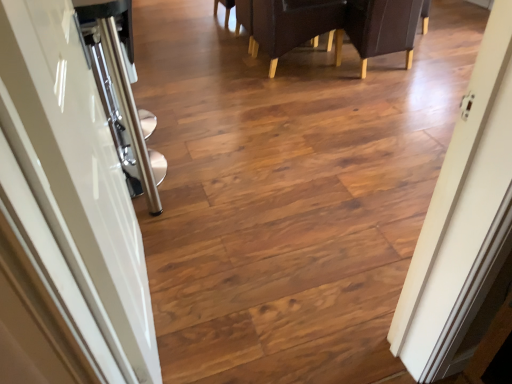
Identify the location of leather-like dark brown chair at upper center. (331, 25).

Identify the location of dark brown leather armchair at upper right, the second armchair from the left. This screenshot has height=384, width=512. (380, 28).

Find the location of a particular element. Image resolution: width=512 pixels, height=384 pixels. glossy white door at left is located at coordinates (67, 208).

Is leather-like dark brown chair at upper center wider than dark brown leather armchair at upper right, the second armchair from the left?

Yes.

Which object is further away from the camera, leather-like dark brown chair at upper center or dark brown leather armchair at upper right, positioned as the first armchair in right-to-left order?

leather-like dark brown chair at upper center is behind.

Which point is more distant from viewer, [257,1] or [412,18]?

The point [257,1] is more distant.

Is leather-like dark brown chair at upper center far away from dark brown leather armchair at upper right, the second armchair from the left?

That's not correct — leather-like dark brown chair at upper center is a little close to dark brown leather armchair at upper right, the second armchair from the left.

Is dark brown leather armchair at upper center, arranged as the 2th armchair when viewed from the right, far from glossy white door at left?

Indeed, dark brown leather armchair at upper center, arranged as the 2th armchair when viewed from the right, is not near glossy white door at left.

Is dark brown leather armchair at upper center, acting as the first armchair starting from the left, surrounding glossy white door at left?

Actually, glossy white door at left is outside dark brown leather armchair at upper center, acting as the first armchair starting from the left.

In terms of size, does dark brown leather armchair at upper center, arranged as the 2th armchair when viewed from the right, appear bigger or smaller than glossy white door at left?

Clearly, dark brown leather armchair at upper center, arranged as the 2th armchair when viewed from the right, is larger in size than glossy white door at left.

Considering the sizes of dark brown leather armchair at upper center, acting as the first armchair starting from the left, and glossy white door at left in the image, is dark brown leather armchair at upper center, acting as the first armchair starting from the left, taller or shorter than glossy white door at left?

dark brown leather armchair at upper center, acting as the first armchair starting from the left, is shorter than glossy white door at left.

Could dark brown leather armchair at upper center, acting as the first armchair starting from the left, be considered to be inside leather-like dark brown chair at upper center?

Yes, leather-like dark brown chair at upper center contains dark brown leather armchair at upper center, acting as the first armchair starting from the left.

Is leather-like dark brown chair at upper center not near dark brown leather armchair at upper center, arranged as the 2th armchair when viewed from the right?

No, there isn't a large distance between leather-like dark brown chair at upper center and dark brown leather armchair at upper center, arranged as the 2th armchair when viewed from the right.

Between leather-like dark brown chair at upper center and dark brown leather armchair at upper center, arranged as the 2th armchair when viewed from the right, which one has smaller width?

With smaller width is dark brown leather armchair at upper center, arranged as the 2th armchair when viewed from the right.

How much distance is there between leather-like dark brown chair at upper center and dark brown leather armchair at upper center, arranged as the 2th armchair when viewed from the right?

leather-like dark brown chair at upper center is 3.20 inches away from dark brown leather armchair at upper center, arranged as the 2th armchair when viewed from the right.

Who is more distant, dark brown leather armchair at upper center, acting as the first armchair starting from the left, or dark brown leather armchair at upper right, the second armchair from the left?

dark brown leather armchair at upper center, acting as the first armchair starting from the left, is further away from the camera.

How different are the orientations of dark brown leather armchair at upper center, acting as the first armchair starting from the left, and dark brown leather armchair at upper right, the second armchair from the left, in degrees?

The facing directions of dark brown leather armchair at upper center, acting as the first armchair starting from the left, and dark brown leather armchair at upper right, the second armchair from the left, are 89.5 degrees apart.

Is dark brown leather armchair at upper center, acting as the first armchair starting from the left, taller or shorter than dark brown leather armchair at upper right, the second armchair from the left?

dark brown leather armchair at upper center, acting as the first armchair starting from the left, is shorter than dark brown leather armchair at upper right, the second armchair from the left.

Is dark brown leather armchair at upper center, acting as the first armchair starting from the left, facing away from dark brown leather armchair at upper right, positioned as the first armchair in right-to-left order?

No, dark brown leather armchair at upper center, acting as the first armchair starting from the left, is not facing the opposite direction of dark brown leather armchair at upper right, positioned as the first armchair in right-to-left order.

The image size is (512, 384). Find the location of `door in front of the leather-like dark brown chair at upper center`. door in front of the leather-like dark brown chair at upper center is located at coordinates (67, 208).

Which is correct: leather-like dark brown chair at upper center is inside glossy white door at left, or outside of it?

leather-like dark brown chair at upper center lies outside glossy white door at left.

Consider the image. Is leather-like dark brown chair at upper center with glossy white door at left?

No, leather-like dark brown chair at upper center is not next to glossy white door at left.

Considering the points (343, 31) and (253, 30), which point is behind, point (343, 31) or point (253, 30)?

Positioned behind is point (343, 31).

Is dark brown leather armchair at upper right, positioned as the first armchair in right-to-left order, positioned beyond the bounds of dark brown leather armchair at upper center, arranged as the 2th armchair when viewed from the right?

Indeed, dark brown leather armchair at upper right, positioned as the first armchair in right-to-left order, is completely outside dark brown leather armchair at upper center, arranged as the 2th armchair when viewed from the right.

Is dark brown leather armchair at upper right, positioned as the first armchair in right-to-left order, positioned before dark brown leather armchair at upper center, arranged as the 2th armchair when viewed from the right?

Yes, it is in front of dark brown leather armchair at upper center, arranged as the 2th armchair when viewed from the right.

Could you tell me if dark brown leather armchair at upper right, positioned as the first armchair in right-to-left order, is turned towards dark brown leather armchair at upper center, acting as the first armchair starting from the left?

No, dark brown leather armchair at upper right, positioned as the first armchair in right-to-left order, is not facing towards dark brown leather armchair at upper center, acting as the first armchair starting from the left.

Is dark brown leather armchair at upper right, the second armchair from the left, facing towards leather-like dark brown chair at upper center?

Yes, dark brown leather armchair at upper right, the second armchair from the left, is oriented towards leather-like dark brown chair at upper center.

From a real-world perspective, count 1st armchairs upward from the leather-like dark brown chair at upper center and point to it. Please provide its 2D coordinates.

[(380, 28)]

Considering the sizes of objects dark brown leather armchair at upper right, positioned as the first armchair in right-to-left order, and leather-like dark brown chair at upper center in the image provided, who is wider, dark brown leather armchair at upper right, positioned as the first armchair in right-to-left order, or leather-like dark brown chair at upper center?

leather-like dark brown chair at upper center.

What are the coordinates of `the 1st armchair positioned below the leather-like dark brown chair at upper center (from the image's perspective)` in the screenshot? It's located at (380, 28).

This screenshot has height=384, width=512. I want to click on armchair that is the 1st object directly below the glossy white door at left (from a real-world perspective), so click(x=292, y=25).

Which object lies further to the anchor point glossy white door at left, dark brown leather armchair at upper right, the second armchair from the left, or dark brown leather armchair at upper center, arranged as the 2th armchair when viewed from the right?

dark brown leather armchair at upper right, the second armchair from the left.

When comparing their distances from dark brown leather armchair at upper right, positioned as the first armchair in right-to-left order, does leather-like dark brown chair at upper center or glossy white door at left seem further?

Based on the image, glossy white door at left appears to be further to dark brown leather armchair at upper right, positioned as the first armchair in right-to-left order.

Estimate the real-world distances between objects in this image. Which object is further from glossy white door at left, dark brown leather armchair at upper center, acting as the first armchair starting from the left, or dark brown leather armchair at upper right, positioned as the first armchair in right-to-left order?

Based on the image, dark brown leather armchair at upper right, positioned as the first armchair in right-to-left order, appears to be further to glossy white door at left.

Considering their positions, is glossy white door at left positioned closer to dark brown leather armchair at upper right, positioned as the first armchair in right-to-left order, than dark brown leather armchair at upper center, acting as the first armchair starting from the left?

Among the two, dark brown leather armchair at upper center, acting as the first armchair starting from the left, is located nearer to dark brown leather armchair at upper right, positioned as the first armchair in right-to-left order.

Looking at the image, which one is located further to dark brown leather armchair at upper center, acting as the first armchair starting from the left, dark brown leather armchair at upper right, the second armchair from the left, or leather-like dark brown chair at upper center?

dark brown leather armchair at upper right, the second armchair from the left, is positioned further to the anchor dark brown leather armchair at upper center, acting as the first armchair starting from the left.

When comparing their distances from dark brown leather armchair at upper center, acting as the first armchair starting from the left, does leather-like dark brown chair at upper center or dark brown leather armchair at upper right, the second armchair from the left, seem closer?

leather-like dark brown chair at upper center.

Considering their positions, is dark brown leather armchair at upper right, the second armchair from the left, positioned further to dark brown leather armchair at upper center, arranged as the 2th armchair when viewed from the right, than glossy white door at left?

glossy white door at left is positioned further to the anchor dark brown leather armchair at upper center, arranged as the 2th armchair when viewed from the right.

Estimate the real-world distances between objects in this image. Which object is further from dark brown leather armchair at upper center, acting as the first armchair starting from the left, glossy white door at left or leather-like dark brown chair at upper center?

The object further to dark brown leather armchair at upper center, acting as the first armchair starting from the left, is glossy white door at left.

The width and height of the screenshot is (512, 384). I want to click on armchair between glossy white door at left and dark brown leather armchair at upper center, arranged as the 2th armchair when viewed from the right, in the front-back direction, so click(x=380, y=28).

At what (x,y) coordinates should I click in order to perform the action: click on furniture located between dark brown leather armchair at upper center, arranged as the 2th armchair when viewed from the right, and dark brown leather armchair at upper right, positioned as the first armchair in right-to-left order, in the left-right direction. Please return your answer as a coordinate pair (x, y). The width and height of the screenshot is (512, 384). Looking at the image, I should click on (331, 25).